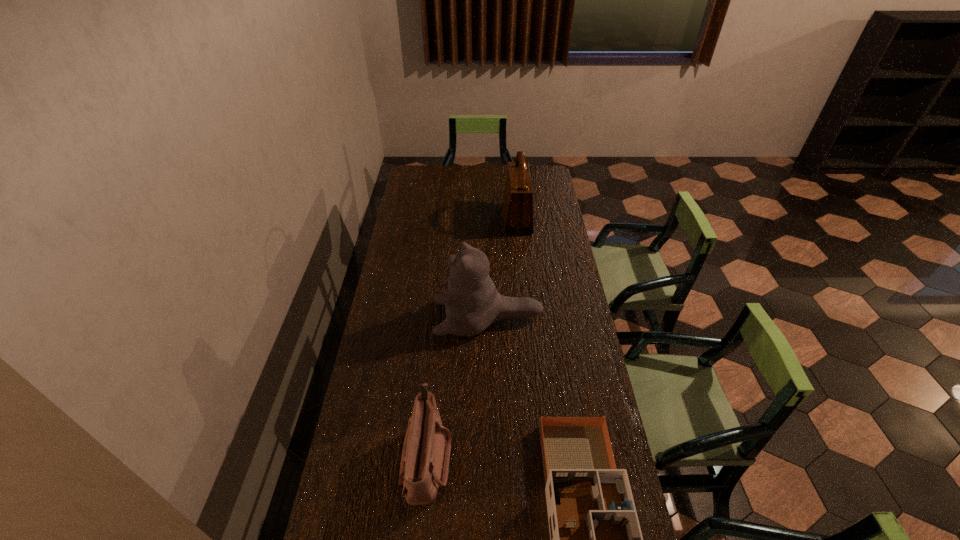
Image resolution: width=960 pixels, height=540 pixels. Find the location of `the right shoulder bag`. the right shoulder bag is located at coordinates (517, 212).

Where is `the taller shoulder bag`? This screenshot has width=960, height=540. the taller shoulder bag is located at coordinates point(517,212).

What are the coordinates of `the second farthest object` in the screenshot? It's located at (472, 303).

Locate an element on the screen. This screenshot has height=540, width=960. the second shortest object is located at coordinates (424, 466).

At what (x,y) coordinates should I click in order to perform the action: click on the left shoulder bag. Please return your answer as a coordinate pair (x, y). This screenshot has width=960, height=540. Looking at the image, I should click on (424, 466).

This screenshot has width=960, height=540. In order to click on vacant space situated on the front flap of the right shoulder bag in this screenshot , I will do `click(449, 219)`.

Locate an element on the screen. This screenshot has height=540, width=960. vacant area situated on the front flap of the right shoulder bag is located at coordinates (447, 219).

This screenshot has width=960, height=540. What are the coordinates of `vacant area situated on the front flap of the right shoulder bag` in the screenshot? It's located at (471, 219).

At what (x,y) coordinates should I click in order to perform the action: click on vacant space located 0.160m on the face of the second farthest object. Please return your answer as a coordinate pair (x, y). This screenshot has height=540, width=960. Looking at the image, I should click on (394, 318).

I want to click on free spot located on the face of the second farthest object, so click(x=378, y=318).